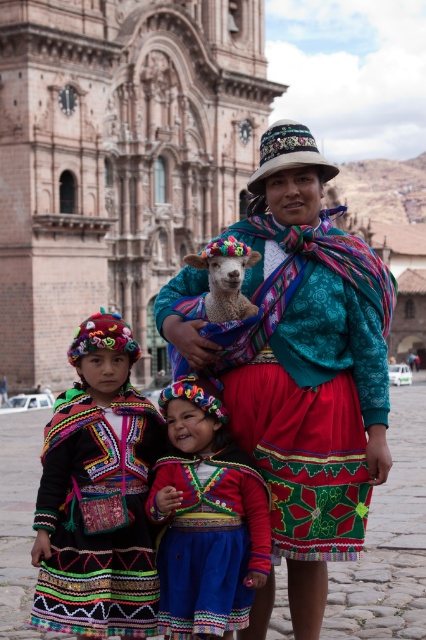
Question: Which of the following is the closest to the observer?

Choices:
 (A) multicolored embroidered jacket at center
 (B) textured woolen shawl at center
 (C) multicolored woven fabric at center

Answer: (C)

Question: Is textured woolen shawl at center positioned in front of multicolored woven fabric at center?

Choices:
 (A) yes
 (B) no

Answer: (B)

Question: Which is farther from the fluffy woolen lamb at center?

Choices:
 (A) textured woolen shawl at center
 (B) multicolored embroidered jacket at center
 (C) multicolored woven fabric at center

Answer: (C)

Question: Among these objects, which one is farthest from the camera?

Choices:
 (A) textured woolen shawl at center
 (B) multicolored woven fabric at center
 (C) fluffy woolen lamb at center
 (D) multicolored embroidered jacket at center

Answer: (C)

Question: Does textured woolen shawl at center appear under multicolored woven fabric at center?

Choices:
 (A) yes
 (B) no

Answer: (B)

Question: Is the position of textured woolen shawl at center more distant than that of fluffy woolen lamb at center?

Choices:
 (A) no
 (B) yes

Answer: (A)